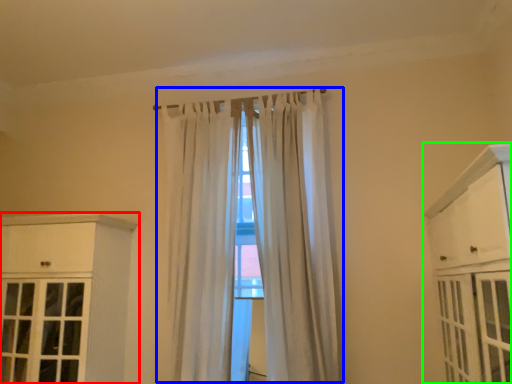
Question: Based on their relative distances, which object is farther from cabinetry (highlighted by a red box)? Choose from curtain (highlighted by a blue box) and cabinetry (highlighted by a green box).

Choices:
 (A) curtain
 (B) cabinetry

Answer: (B)